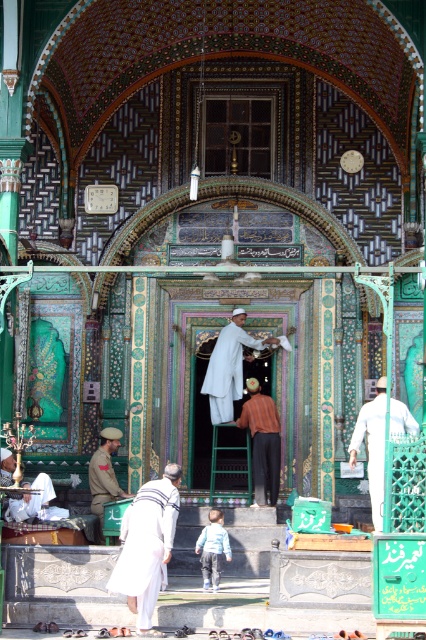
Is khaki uniform at lower left further to camera compared to khaki cotton robe at lower left?

No, khaki uniform at lower left is closer to the viewer.

Does khaki uniform at lower left appear on the left side of khaki cotton robe at lower left?

Incorrect, khaki uniform at lower left is not on the left side of khaki cotton robe at lower left.

At what (x,y) coordinates should I click in order to perform the action: click on khaki uniform at lower left. Please return your answer as a coordinate pair (x, y). Looking at the image, I should click on (104, 474).

Is point (379, 424) farther from camera compared to point (203, 556)?

Yes, it is.

Is point (373, 456) positioned before point (209, 554)?

No, (373, 456) is further to viewer.

The width and height of the screenshot is (426, 640). What are the coordinates of `white matte clothing at center` in the screenshot? It's located at (373, 448).

From the picture: Is the position of white cotton robe at center more distant than that of brown leather robe at center?

That is True.

Consider the image. Can you confirm if white cotton robe at center is positioned above brown leather robe at center?

Yes, white cotton robe at center is above brown leather robe at center.

Image resolution: width=426 pixels, height=640 pixels. What do you see at coordinates (227, 368) in the screenshot?
I see `white cotton robe at center` at bounding box center [227, 368].

Locate an element on the screen. The width and height of the screenshot is (426, 640). white cotton robe at center is located at coordinates (227, 368).